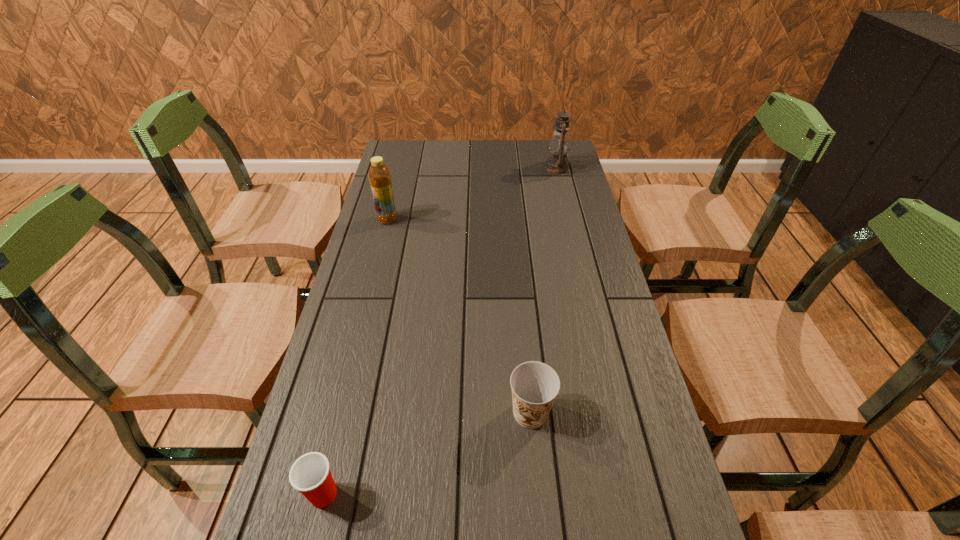
Where is `vacant area situated 0.330m on the back of the right Dixie cup`? This screenshot has height=540, width=960. vacant area situated 0.330m on the back of the right Dixie cup is located at coordinates (519, 288).

Where is `vacant space located on the right of the left Dixie cup`? Image resolution: width=960 pixels, height=540 pixels. vacant space located on the right of the left Dixie cup is located at coordinates (540, 495).

At what (x,y) coordinates should I click in order to perform the action: click on object situated at the far edge. Please return your answer as a coordinate pair (x, y). Looking at the image, I should click on (559, 145).

Where is `bottle at the left edge`? bottle at the left edge is located at coordinates (379, 175).

The image size is (960, 540). Identify the location of Dixie cup at the left edge. (310, 474).

Where is `object that is positioned at the right edge`? object that is positioned at the right edge is located at coordinates (559, 145).

The image size is (960, 540). I want to click on object situated at the far right corner, so click(559, 145).

In order to click on vacant area at the far edge in this screenshot , I will do `click(463, 143)`.

This screenshot has width=960, height=540. Identify the location of vacant space at the left edge. (360, 258).

At what (x,y) coordinates should I click in order to perform the action: click on vacant space at the right edge. Please return your answer as a coordinate pair (x, y). The height and width of the screenshot is (540, 960). Looking at the image, I should click on (556, 202).